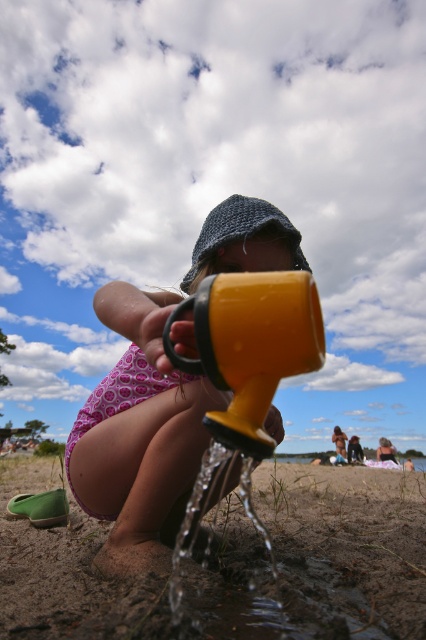
You are a parent at the beach and want to give your child a drink. You have a transparent plastic water at lower center and a yellow plastic cup at center. Which one can hold more liquid?

The transparent plastic water at lower center can hold more liquid because its width is larger than the yellow plastic cup at center.

You are a photographer aiming to capture the yellow matte watering can at center in your shot. Given that your camera is focused on the child at the lower part of the image, will the watering can be in focus if the depth of field extends 0.2 units above the child?

The yellow matte watering can at center is located at point [138,435]. Since the depth of field extends 0.2 units above the child, which is at the lower part, the watering can may or may not be in focus depending on the exact position. However, the description does not provide the child or the depth of field range in coordinates, so we cannot determine this conclusively.